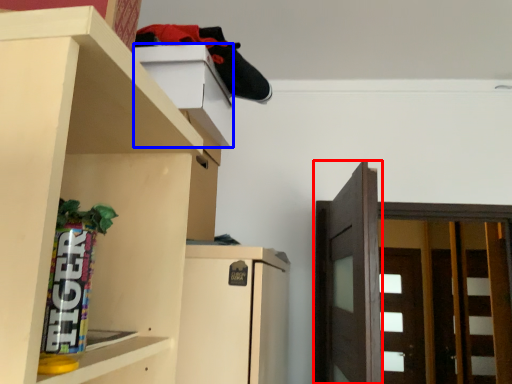
Question: Among these objects, which one is nearest to the camera, door (highlighted by a red box) or cabinet (highlighted by a blue box)?

Choices:
 (A) door
 (B) cabinet

Answer: (B)